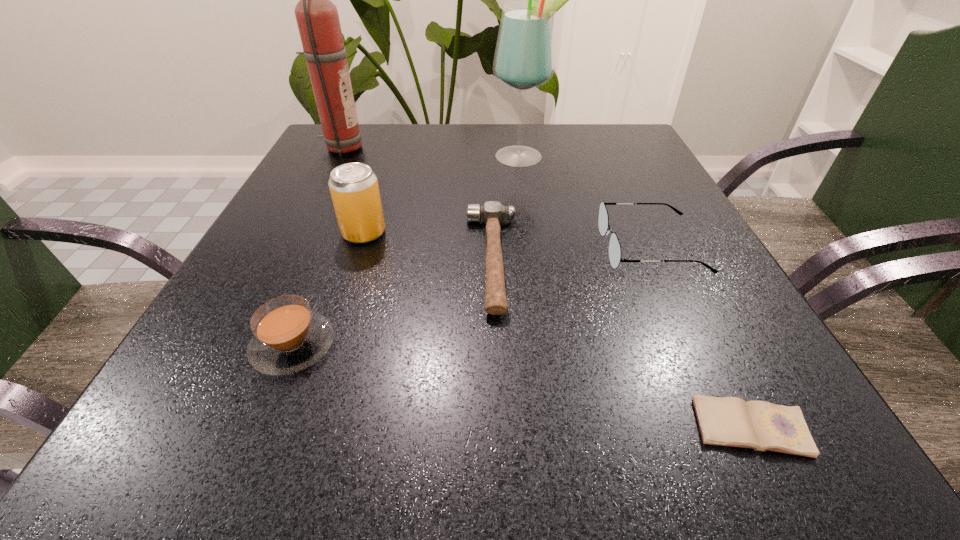
Locate an element on the screen. The height and width of the screenshot is (540, 960). vacant space at the near edge of the desktop is located at coordinates (431, 430).

The height and width of the screenshot is (540, 960). Identify the location of free spot at the left edge of the desktop. pos(249,267).

The height and width of the screenshot is (540, 960). I want to click on vacant space at the right edge, so click(x=717, y=307).

Locate an element on the screen. This screenshot has height=540, width=960. blank space at the near left corner of the desktop is located at coordinates (231, 466).

The width and height of the screenshot is (960, 540). I want to click on vacant space at the far right corner of the desktop, so click(x=615, y=164).

Locate an element on the screen. vacant area that lies between the alcohol and the fire extinguisher is located at coordinates (431, 152).

Locate an element on the screen. Image resolution: width=960 pixels, height=540 pixels. vacant region between the fire extinguisher and the second shortest object is located at coordinates (417, 204).

This screenshot has height=540, width=960. Identify the location of free point between the cappuccino and the spectacles. (471, 296).

Image resolution: width=960 pixels, height=540 pixels. What are the coordinates of `vacant area that lies between the spectacles and the shortest object` in the screenshot? It's located at (701, 338).

Identify the location of empty space that is in between the alcohol and the pop (soda). The image size is (960, 540). (443, 195).